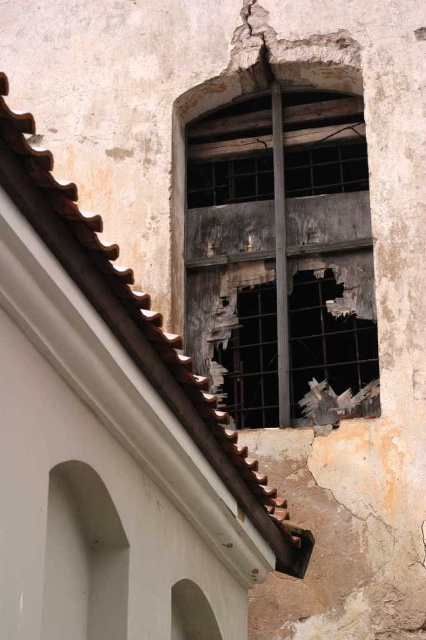
Question: Which point appears closest to the camera in this image?

Choices:
 (A) (296, 296)
 (B) (290, 173)

Answer: (A)

Question: Among these points, which one is farthest from the camera?

Choices:
 (A) (196, 595)
 (B) (342, 118)
 (C) (322, 369)

Answer: (B)

Question: Does rusty metal window at upper center come behind rusty metal window at center?

Choices:
 (A) yes
 (B) no

Answer: (B)

Question: Which point is closer to the camera taking this photo?

Choices:
 (A) (199, 620)
 (B) (359, 124)

Answer: (A)

Question: Does rusty metal window at upper center appear on the left side of rusty metal window at center?

Choices:
 (A) yes
 (B) no

Answer: (A)

Question: Is rusty metal window at center smaller than smooth brown stone arch at lower left?

Choices:
 (A) no
 (B) yes

Answer: (A)